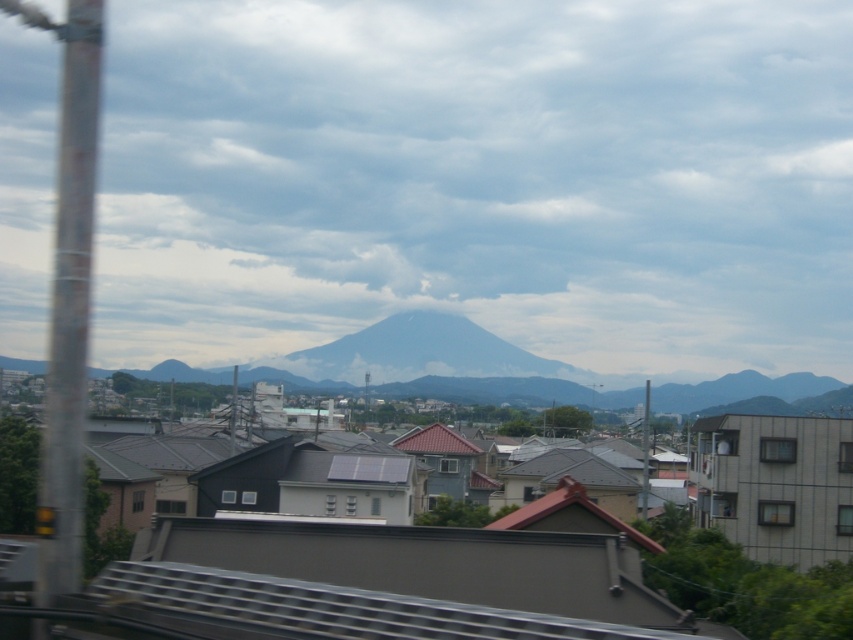
You are a drone operator flying a drone that needs to pass between the metallic gray pole at left and the metallic pole at center without hitting any obstacles. Based on the scene, which pole is higher and should you adjust your flight path accordingly?

The metallic gray pole at left is located above the metallic pole at center, so you should adjust your flight path to navigate below the metallic gray pole at left and above the metallic pole at center to avoid collision.

You are a drone operator flying a drone over the residential area. You notice two metallic poles in the image. Which one is higher in the sky between the metallic gray pole at left and the metallic pole at right?

The metallic gray pole at left is located above the metallic pole at right, so it is higher in the sky.